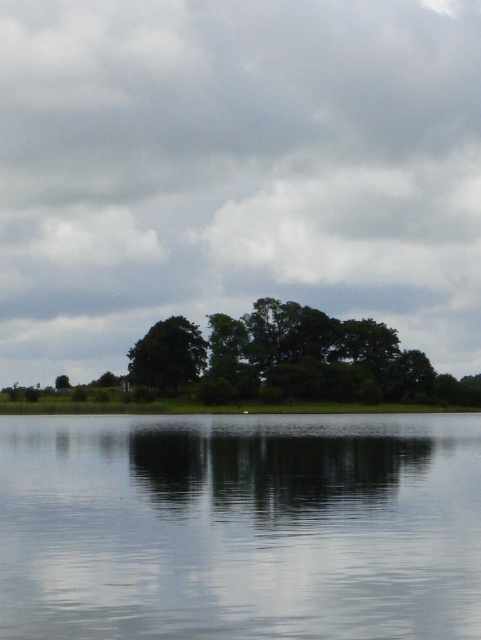
Who is taller, transparent water at center or green leafy tree at center?

green leafy tree at center is taller.

Can you confirm if transparent water at center is positioned below green leafy tree at center?

Yes.

Which is in front, point (53, 438) or point (185, 358)?

Point (53, 438)

The image size is (481, 640). I want to click on transparent water at center, so click(x=240, y=525).